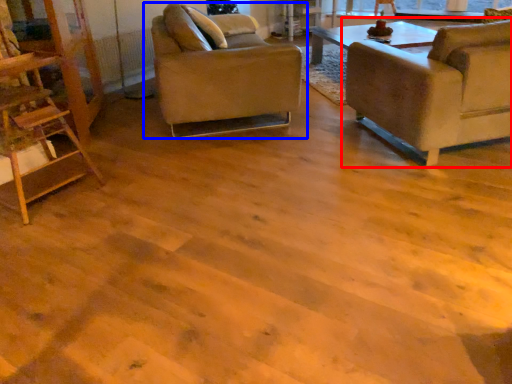
Question: Among these objects, which one is farthest to the camera, chair (highlighted by a red box) or chair (highlighted by a blue box)?

Choices:
 (A) chair
 (B) chair

Answer: (B)